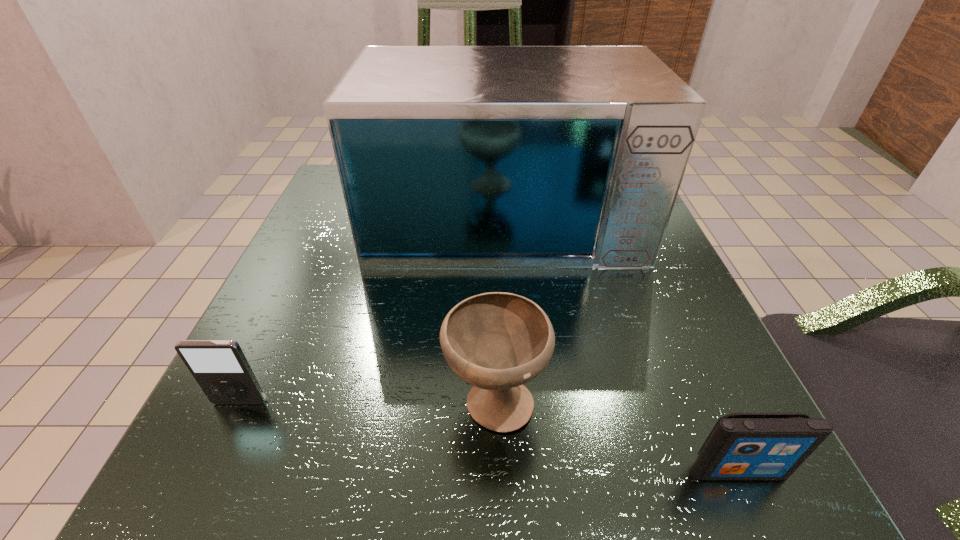
This screenshot has height=540, width=960. In the image, there is a desktop. Identify the location of vacant space at the near edge. (500, 439).

What are the coordinates of `vacant space at the left edge of the desktop` in the screenshot? It's located at (311, 369).

In order to click on blank area at the far left corner in this screenshot , I will do `click(330, 208)`.

In the image, there is a desktop. Identify the location of vacant space at the near left corner. (248, 437).

At what (x,y) coordinates should I click in order to perform the action: click on free location at the near right corner of the desktop. Please return your answer as a coordinate pair (x, y). Image resolution: width=960 pixels, height=540 pixels. Looking at the image, I should click on (693, 446).

Find the location of a particular element. vacant space that is in between the nearest object and the farther iPod is located at coordinates (489, 436).

Where is `vacant area that lies between the nearer iPod and the third shortest object`? vacant area that lies between the nearer iPod and the third shortest object is located at coordinates (616, 436).

At what (x,y) coordinates should I click in order to perform the action: click on vacant point located between the nearest object and the chalice. Please return your answer as a coordinate pair (x, y). The width and height of the screenshot is (960, 540). Looking at the image, I should click on (616, 436).

Where is `free space that is in between the farther iPod and the right iPod`? The image size is (960, 540). free space that is in between the farther iPod and the right iPod is located at coordinates (489, 436).

Find the location of `free spot between the left iPod and the nearer iPod`. free spot between the left iPod and the nearer iPod is located at coordinates (489, 436).